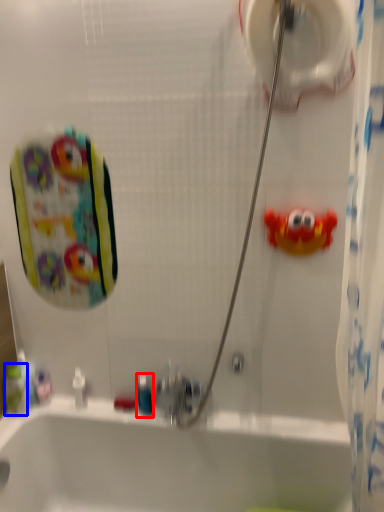
Question: Which object appears farthest to the camera in this image, mouthwash (highlighted by a red box) or mouthwash (highlighted by a blue box)?

Choices:
 (A) mouthwash
 (B) mouthwash

Answer: (A)